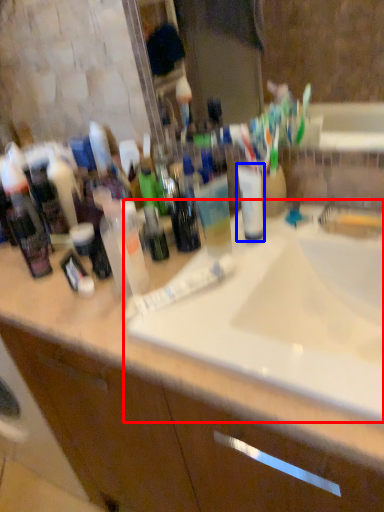
Question: Which of the following is the farthest to the observer, sink (highlighted by a red box) or mouthwash (highlighted by a blue box)?

Choices:
 (A) sink
 (B) mouthwash

Answer: (B)